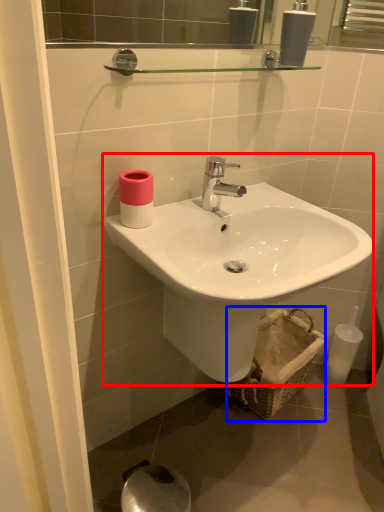
Question: Which object is closer to the camera taking this photo, sink (highlighted by a red box) or basket (highlighted by a blue box)?

Choices:
 (A) sink
 (B) basket

Answer: (A)